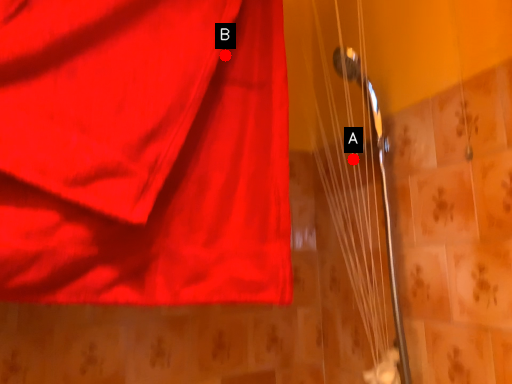
Question: Two points are circled on the image, labeled by A and B beside each circle. Which of the following is the closest to the observer?

Choices:
 (A) A is closer
 (B) B is closer

Answer: (B)